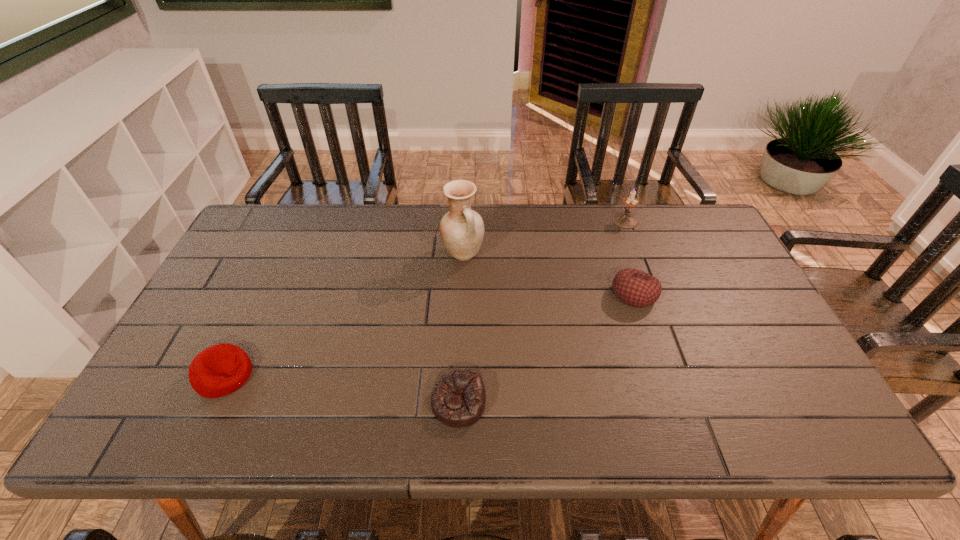
Where is `blank space at the left edge of the desktop`? This screenshot has width=960, height=540. blank space at the left edge of the desktop is located at coordinates (212, 282).

Locate an element on the screen. This screenshot has width=960, height=540. vacant space at the right edge of the desktop is located at coordinates (745, 348).

At what (x,y) coordinates should I click in order to perform the action: click on free location at the far left corner. Please return your answer as a coordinate pair (x, y). Looking at the image, I should click on (307, 204).

At what (x,y) coordinates should I click in order to perform the action: click on free spot between the leftmost beanbag and the shortest beanbag. Please return your answer as a coordinate pair (x, y). Looking at the image, I should click on (342, 389).

You are a GUI agent. You are given a task and a screenshot of the screen. Output one action in this format:
    pyautogui.click(x=<x>, y=<y>)
    Task: Click on the free area in between the leftmost object and the second beanbag from left to right
    
    Given the screenshot: What is the action you would take?
    pyautogui.click(x=342, y=389)

Find the location of a particular element. free space between the farthest object and the third farthest object is located at coordinates (630, 258).

What are the coordinates of `free space between the pottery and the fourth shortest object` in the screenshot? It's located at (544, 237).

This screenshot has width=960, height=540. I want to click on free point between the leftmost beanbag and the fourth shortest object, so click(x=425, y=298).

The height and width of the screenshot is (540, 960). What are the coordinates of `free spot between the shortest object and the candle holder` in the screenshot? It's located at (541, 312).

Identify the location of vacant area that lies between the second farthest object and the leftmost object. (344, 315).